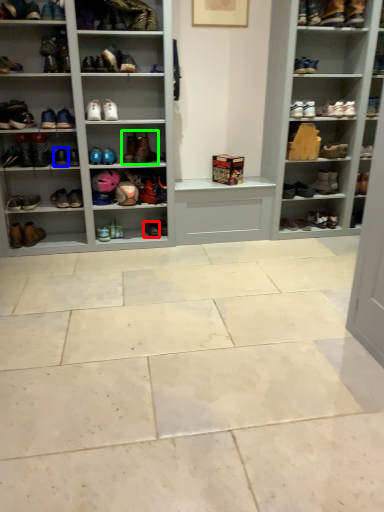
Question: Which object is the closest to the shoe (highlighted by a red box)? Choose among these: shoe (highlighted by a blue box) or footwear (highlighted by a green box).

Choices:
 (A) shoe
 (B) footwear

Answer: (B)